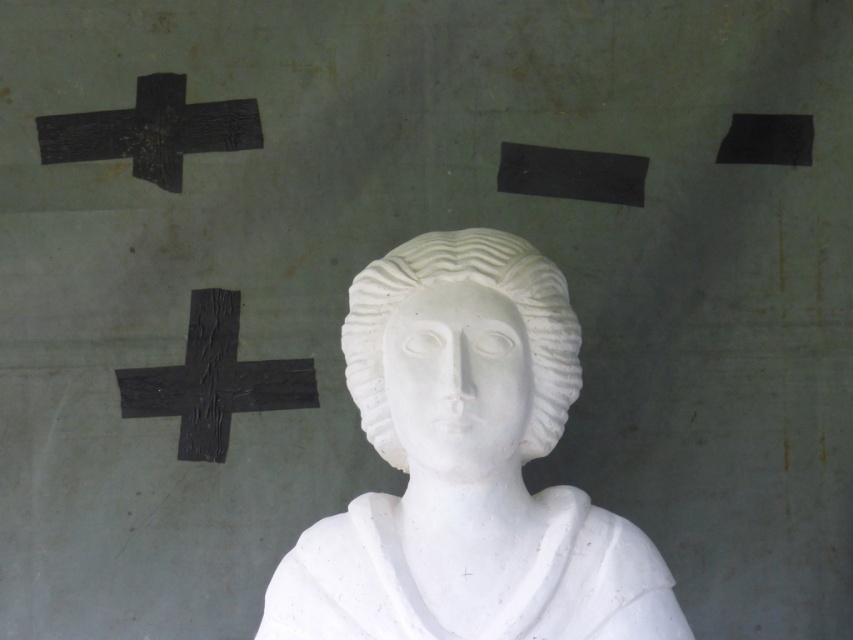
Question: Does black crumpled paper at left have a larger size compared to black textured cross at upper left?

Choices:
 (A) no
 (B) yes

Answer: (B)

Question: Estimate the real-world distances between objects in this image. Which object is farther from the white marble bust at center?

Choices:
 (A) black crumpled paper at left
 (B) white marble head at center

Answer: (A)

Question: Which object is closer to the camera taking this photo?

Choices:
 (A) black crumpled paper at left
 (B) white marble bust at center
 (C) white marble head at center
 (D) black textured cross at upper left

Answer: (B)

Question: Which object is the closest to the black crumpled paper at left?

Choices:
 (A) white marble bust at center
 (B) black textured cross at upper left

Answer: (B)

Question: Does white marble head at center have a larger size compared to black textured cross at upper left?

Choices:
 (A) no
 (B) yes

Answer: (B)

Question: Does white marble head at center have a larger size compared to black crumpled paper at left?

Choices:
 (A) yes
 (B) no

Answer: (A)